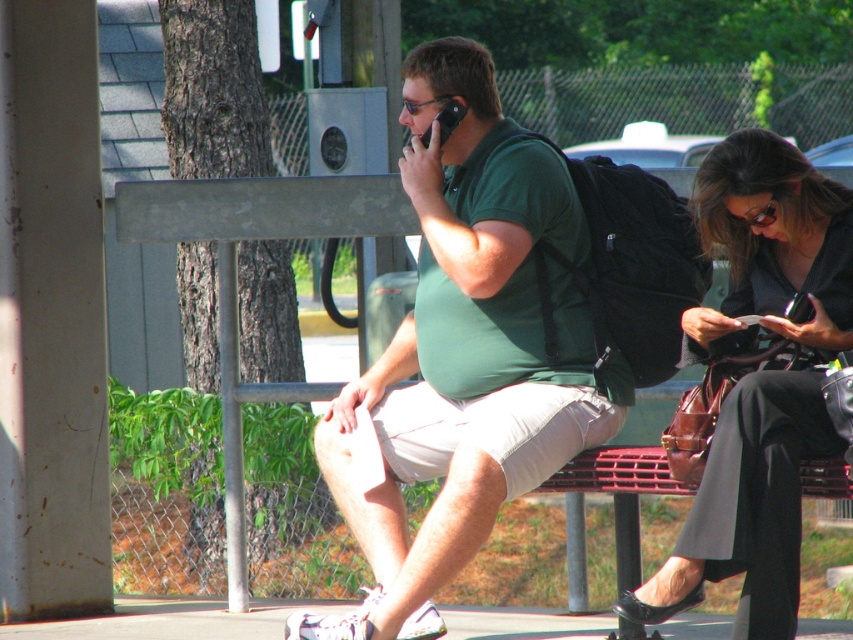
Question: Which point is closer to the camera?

Choices:
 (A) green matte shirt at center
 (B) black plastic phone at upper center

Answer: (A)

Question: Which object is farther from the camera taking this photo?

Choices:
 (A) matte brown purse at lower right
 (B) black plastic phone at upper center

Answer: (B)

Question: Can you confirm if green matte shirt at center is bigger than black plastic phone at upper center?

Choices:
 (A) no
 (B) yes

Answer: (B)

Question: Which of the following is the farthest from the observer?

Choices:
 (A) (730, 572)
 (B) (463, 320)

Answer: (B)

Question: Does green matte shirt at center appear over matte brown purse at lower right?

Choices:
 (A) no
 (B) yes

Answer: (B)

Question: Can you confirm if green matte shirt at center is positioned to the left of black plastic phone at upper center?

Choices:
 (A) yes
 (B) no

Answer: (B)